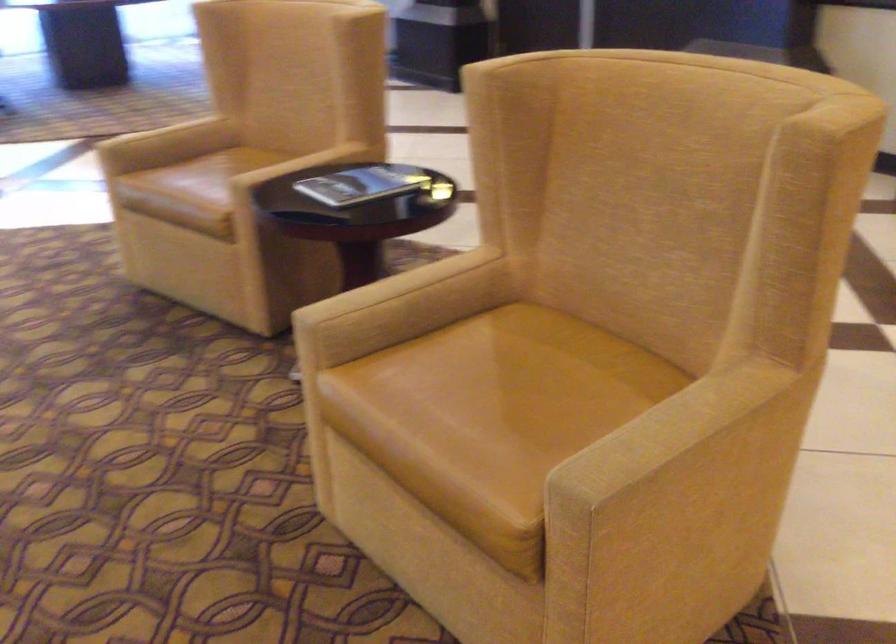
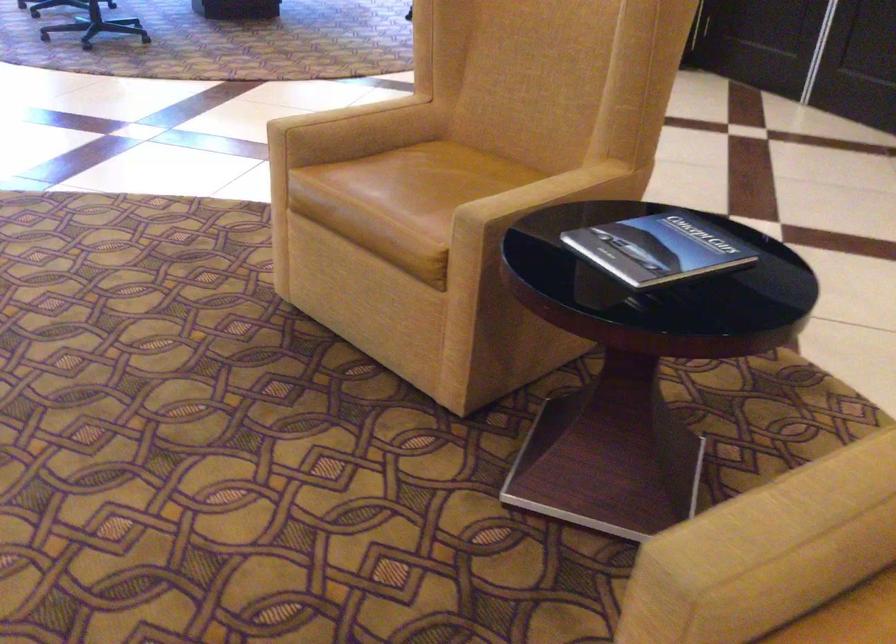
Find the pixel in the second image that matches point (359, 184) in the first image.

(657, 249)